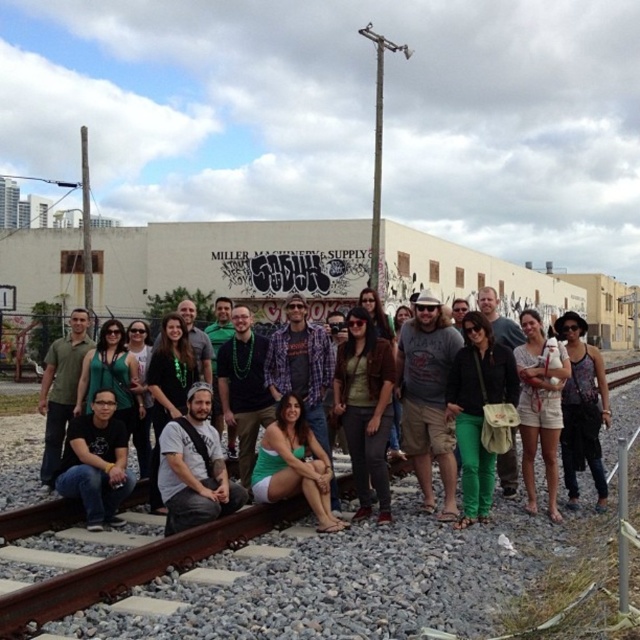
Between green fabric dress at center and matte green pants at center, which one is positioned lower?

Positioned lower is green fabric dress at center.

Locate an element on the screen. This screenshot has height=640, width=640. green fabric dress at center is located at coordinates (541, 396).

Which is below, rusty metal train track at center or matte green pants at center?

Positioned lower is rusty metal train track at center.

Which is more to the right, rusty metal train track at center or matte green pants at center?

From the viewer's perspective, rusty metal train track at center appears more on the right side.

The width and height of the screenshot is (640, 640). What do you see at coordinates (273, 577) in the screenshot?
I see `rusty metal train track at center` at bounding box center [273, 577].

At what (x,y) coordinates should I click in order to perform the action: click on rusty metal train track at center. Please return your answer as a coordinate pair (x, y). Looking at the image, I should click on (273, 577).

Does point (600, 413) come behind point (532, 500)?

Yes, it is.

Can you confirm if matte black tank top at center is smaller than green denim shorts at center?

Correct, matte black tank top at center occupies less space than green denim shorts at center.

The height and width of the screenshot is (640, 640). What are the coordinates of `matte black tank top at center` in the screenshot? It's located at (582, 410).